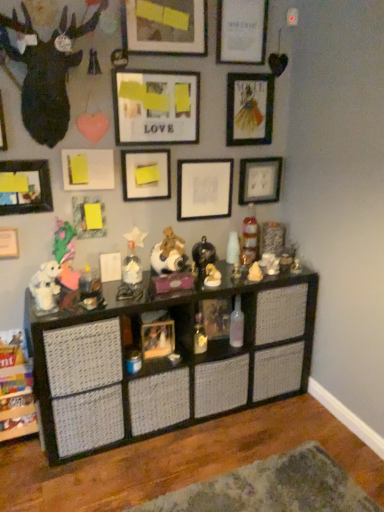
Question: Is point [x=24, y=197] closer or farther from the camera than point [x=251, y=137]?

Choices:
 (A) farther
 (B) closer

Answer: (B)

Question: Is matte black picture frame at left, which is counted as the tenth picture frame, starting from the top, wider or thinner than matte black picture frame at upper right, marked as the third picture frame in a top-to-bottom arrangement?

Choices:
 (A) thin
 (B) wide

Answer: (B)

Question: Considering the real-world distances, which object is farthest from the matte black picture frame at upper right, marked as the third picture frame in a top-to-bottom arrangement?

Choices:
 (A) fluffy pink stuffed animal at center-left, the 11th toy from the right
 (B) wooden picture frame at center, which appears as the 1th picture frame when ordered from the bottom
 (C) translucent plastic toy at center, arranged as the 5th toy when viewed from the left
 (D) matte black deer head at upper left
 (E) shiny metallic figurine at center, marked as the sixth toy in a right-to-left arrangement

Answer: (B)

Question: Estimate the real-world distances between objects in this image. Which object is closer to the clear plastic bottle at center, which appears as the second toy when viewed from the right?

Choices:
 (A) matte yellow cone at center, the third toy when ordered from right to left
 (B) brushed metal picture frame at upper left, which ranks as the ninth picture frame in bottom-to-top order
 (C) matte white picture frame at upper center, the first picture frame from the top
 (D) white fabric stuffed animal at center, which ranks as the eighth toy in right-to-left order
 (E) white matte picture frame at upper left, the 6th picture frame in the bottom-to-top sequence

Answer: (A)